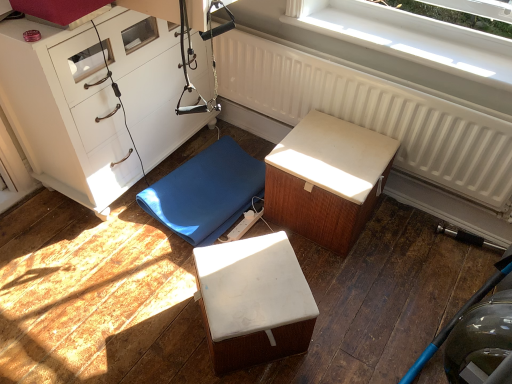
Question: Should I look upward or downward to see blue rubber mat at center, which is the first furniture from left to right?

Choices:
 (A) down
 (B) up

Answer: (B)

Question: Is white matte chest of drawers at left turned away from white plastic window at upper center?

Choices:
 (A) no
 (B) yes

Answer: (A)

Question: Is white matte chest of drawers at left oriented towards white plastic window at upper center?

Choices:
 (A) yes
 (B) no

Answer: (A)

Question: Is white matte chest of drawers at left taller than white plastic window at upper center?

Choices:
 (A) no
 (B) yes

Answer: (B)

Question: From the image's perspective, is white matte chest of drawers at left located above white plastic window at upper center?

Choices:
 (A) no
 (B) yes

Answer: (A)

Question: Is white matte chest of drawers at left not close to white plastic window at upper center?

Choices:
 (A) yes
 (B) no

Answer: (B)

Question: Is white matte chest of drawers at left to the right of white plastic window at upper center from the viewer's perspective?

Choices:
 (A) no
 (B) yes

Answer: (A)

Question: Is white matte cube at center, placed as the 2th furniture when sorted from left to right, a part of white textured radiator at upper center?

Choices:
 (A) yes
 (B) no

Answer: (B)

Question: Is white textured radiator at upper center beside white matte cube at center, the 2th furniture in the right-to-left sequence?

Choices:
 (A) yes
 (B) no

Answer: (B)

Question: Is white textured radiator at upper center aimed at white matte cube at center, the 2th furniture in the right-to-left sequence?

Choices:
 (A) no
 (B) yes

Answer: (B)

Question: Considering the relative sizes of white textured radiator at upper center and white matte cube at center, the 2th furniture in the right-to-left sequence, in the image provided, is white textured radiator at upper center shorter than white matte cube at center, the 2th furniture in the right-to-left sequence,?

Choices:
 (A) yes
 (B) no

Answer: (B)

Question: From the image's perspective, is white textured radiator at upper center below white matte cube at center, placed as the 2th furniture when sorted from left to right?

Choices:
 (A) no
 (B) yes

Answer: (A)

Question: Is white textured radiator at upper center further to the viewer compared to white matte cube at center, placed as the 2th furniture when sorted from left to right?

Choices:
 (A) yes
 (B) no

Answer: (A)

Question: From a real-world perspective, is white textured radiator at upper center located higher than white textured cushion at center, which ranks as the first furniture in right-to-left order?

Choices:
 (A) no
 (B) yes

Answer: (B)